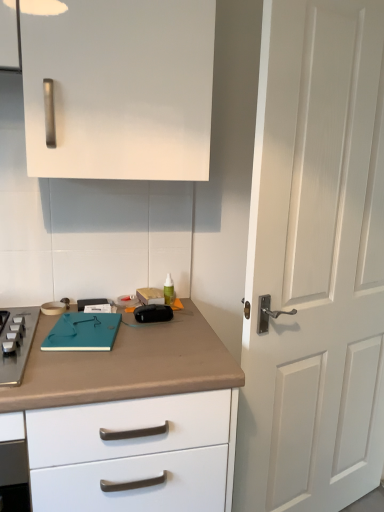
Question: Based on their sizes in the image, would you say teal matte notebook at center is bigger or smaller than white matte door at right?

Choices:
 (A) small
 (B) big

Answer: (A)

Question: From the image's perspective, is teal matte notebook at center located above or below white matte door at right?

Choices:
 (A) below
 (B) above

Answer: (A)

Question: Estimate the real-world distances between objects in this image. Which object is farther from the brown matte countertop at lower left?

Choices:
 (A) teal matte notebook at center
 (B) white matte door at right

Answer: (B)

Question: Which object is the farthest from the teal matte notebook at center?

Choices:
 (A) brown matte countertop at lower left
 (B) white matte door at right

Answer: (B)